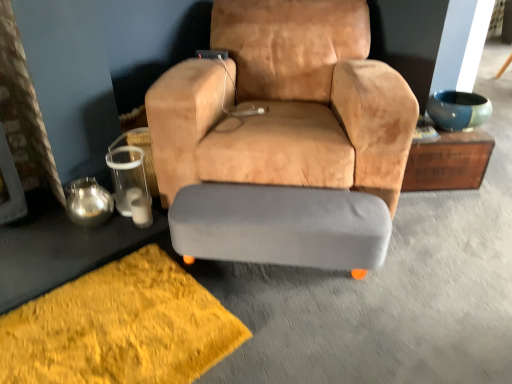
Identify the location of vacant space to the right of gray fabric ottoman at center. Image resolution: width=512 pixels, height=384 pixels. (431, 279).